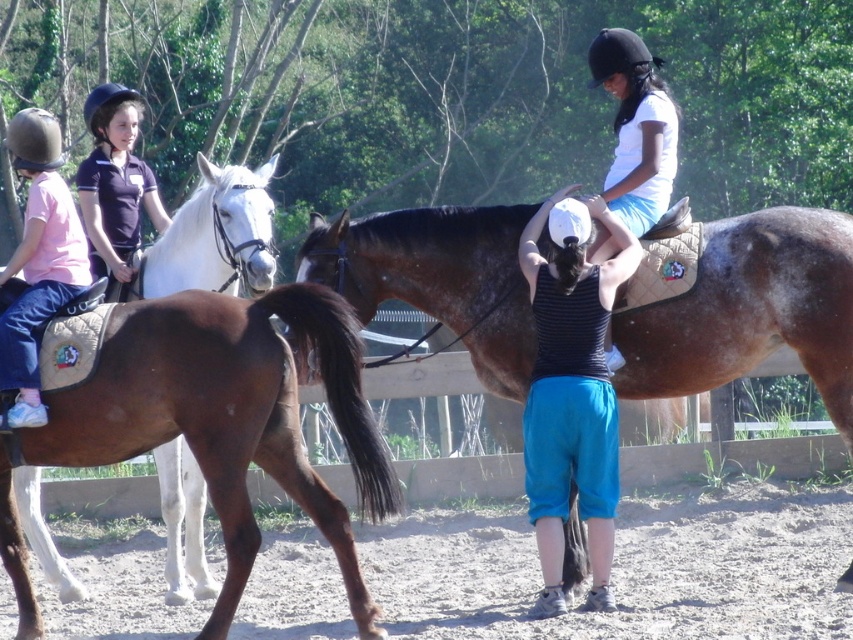
Is white glossy horse at left bigger than matte black helmet at upper left?

Incorrect, white glossy horse at left is not larger than matte black helmet at upper left.

Between white glossy horse at left and matte black helmet at upper left, which one appears on the right side from the viewer's perspective?

white glossy horse at left

Is point (202, 202) closer to viewer compared to point (106, 140)?

Yes, point (202, 202) is closer to viewer.

Where is `white glossy horse at left`? white glossy horse at left is located at coordinates (218, 234).

Which is more to the left, dirt track at lower center or brown leather saddle at lower left?

Positioned to the left is brown leather saddle at lower left.

From the picture: Does dirt track at lower center appear over brown leather saddle at lower left?

Actually, dirt track at lower center is below brown leather saddle at lower left.

The width and height of the screenshot is (853, 640). What do you see at coordinates (627, 568) in the screenshot? I see `dirt track at lower center` at bounding box center [627, 568].

I want to click on dirt track at lower center, so click(x=627, y=568).

Is brown leather saddle at lower left below matte black helmet at upper left?

Indeed, brown leather saddle at lower left is positioned under matte black helmet at upper left.

Which is above, brown leather saddle at lower left or matte black helmet at upper left?

matte black helmet at upper left is above.

Image resolution: width=853 pixels, height=640 pixels. Describe the element at coordinates (229, 417) in the screenshot. I see `brown leather saddle at lower left` at that location.

Find the location of a particular element. The image size is (853, 640). brown leather saddle at lower left is located at coordinates (229, 417).